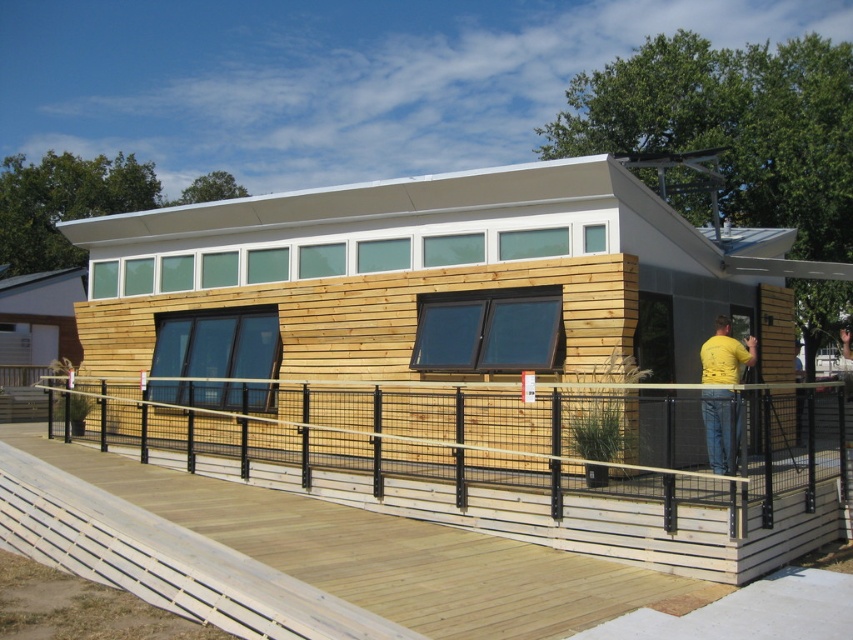
You are an interior designer assessing the building facade. You need to determine which object has a greater width between the wooden slats at lower center and the yellow matte shirt at upper right. Which one is wider?

The wooden slats at lower center are wider than the yellow matte shirt at upper right, as stated in the description that the wooden slats at lower center surpass the yellow matte shirt at upper right in width.

You are a painter standing at the base of the building, holding a 2.5 meter ladder. You need to reach both the wooden slats at lower center and the yellow matte shirt at upper right to touch them both. Can you do this with the ladder you have?

The wooden slats at lower center and yellow matte shirt at upper right are 3.07 meters apart. Since the ladder is only 2.5 meters long, it is not long enough to reach both objects simultaneously. You would need a longer ladder to reach both.